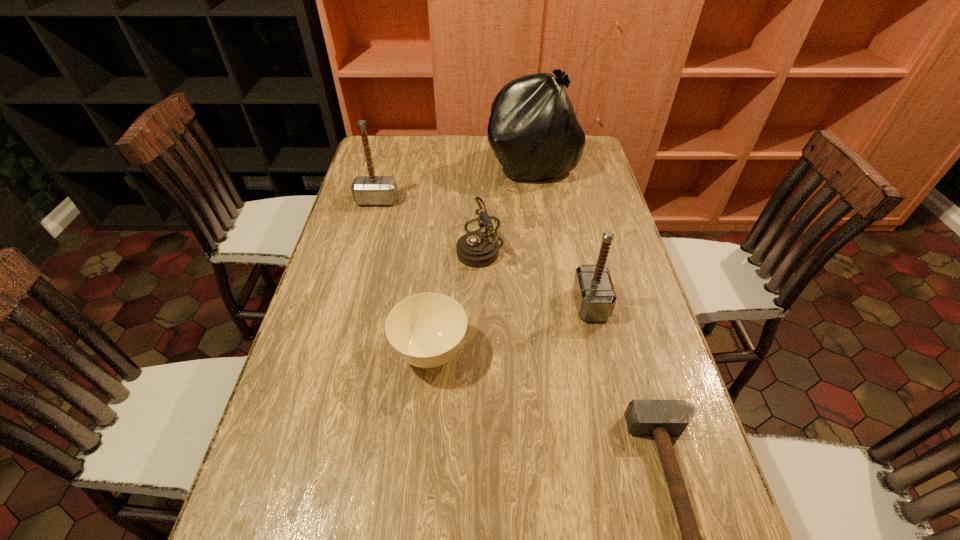
Identify the location of hammer that is the second closest to the leftmost object. (660, 418).

Locate an element on the screen. The width and height of the screenshot is (960, 540). free space that satisfies the following two spatial constraints: 1. on the front side of the second shortest hammer; 2. on the right side of the telephone is located at coordinates pyautogui.click(x=480, y=304).

The width and height of the screenshot is (960, 540). What are the coordinates of `vacant space that satisfies the following two spatial constraints: 1. on the striking surface of the third tallest object; 2. on the right side of the leftmost hammer` in the screenshot? It's located at (349, 304).

I want to click on free location that satisfies the following two spatial constraints: 1. on the striking surface of the farthest hammer; 2. on the left side of the fourth shortest object, so click(x=349, y=304).

Image resolution: width=960 pixels, height=540 pixels. Find the location of `vacant region that satisfies the following two spatial constraints: 1. on the striking surface of the sugar bowl; 2. on the left side of the leftmost hammer`. vacant region that satisfies the following two spatial constraints: 1. on the striking surface of the sugar bowl; 2. on the left side of the leftmost hammer is located at coordinates (336, 353).

You are a GUI agent. You are given a task and a screenshot of the screen. Output one action in this format:
    pyautogui.click(x=<x>, y=<y>)
    Task: Click on the free space that satisfies the following two spatial constraints: 1. on the striking surface of the sugar bowl; 2. on the right side of the fifth nearest object
    The width and height of the screenshot is (960, 540).
    Given the screenshot: What is the action you would take?
    pyautogui.click(x=336, y=353)